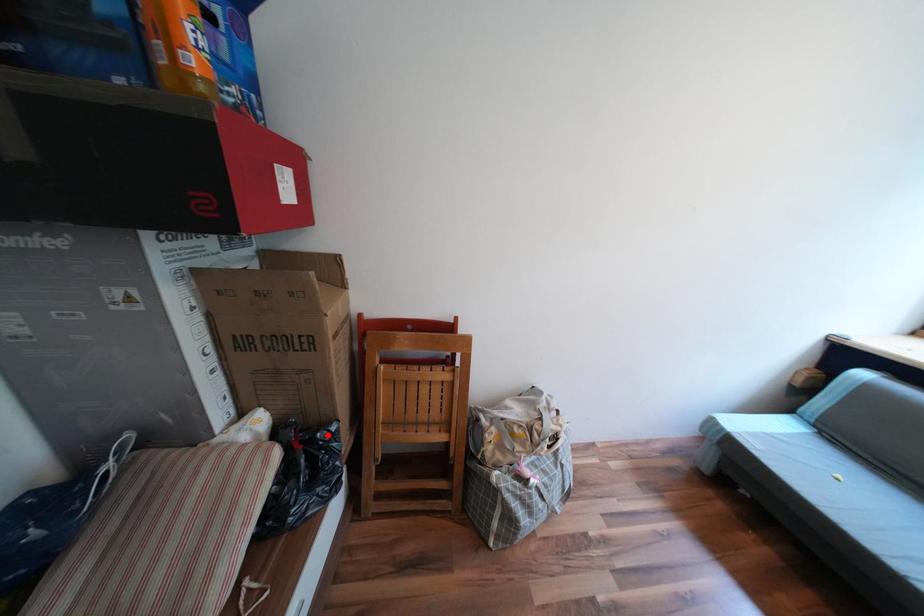
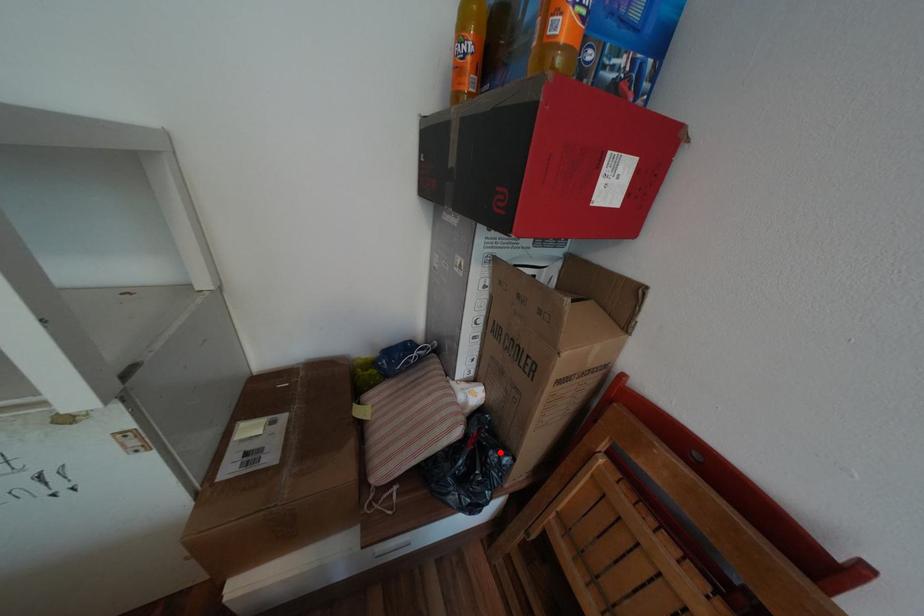
I am providing you with two images of the same scene from different viewpoints. A red point is marked on the first image and another point is marked on the second image. Are the points marked in image1 and image2 representing the same 3D position?

Yes